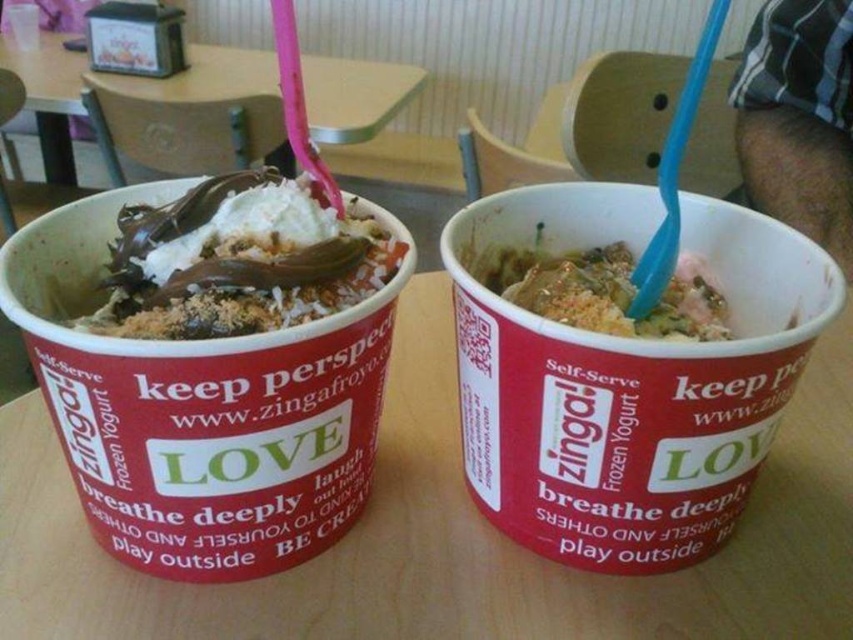
Can you confirm if wooden table at center is taller than crumbly brown topping at center?

Yes, wooden table at center is taller than crumbly brown topping at center.

Who is positioned more to the right, wooden table at center or crumbly brown topping at center?

From the viewer's perspective, crumbly brown topping at center appears more on the right side.

Who is more distant from viewer, [560,620] or [685,285]?

Positioned behind is point [685,285].

The image size is (853, 640). Identify the location of wooden table at center. (450, 538).

Can you confirm if wooden table at center is positioned below wooden table at upper center?

Indeed, wooden table at center is positioned under wooden table at upper center.

Is wooden table at center shorter than wooden table at upper center?

Yes.

Is point (91, 580) behind point (115, 90)?

No.

The width and height of the screenshot is (853, 640). I want to click on wooden table at center, so click(450, 538).

I want to click on chocolate-coated ice cream at left, so click(238, 260).

Who is positioned more to the right, chocolate-coated ice cream at left or wooden table at upper center?

From the viewer's perspective, chocolate-coated ice cream at left appears more on the right side.

Is point (247, 292) more distant than point (355, 125)?

No, it is in front of (355, 125).

Identify the location of chocolate-coated ice cream at left. The width and height of the screenshot is (853, 640). (238, 260).